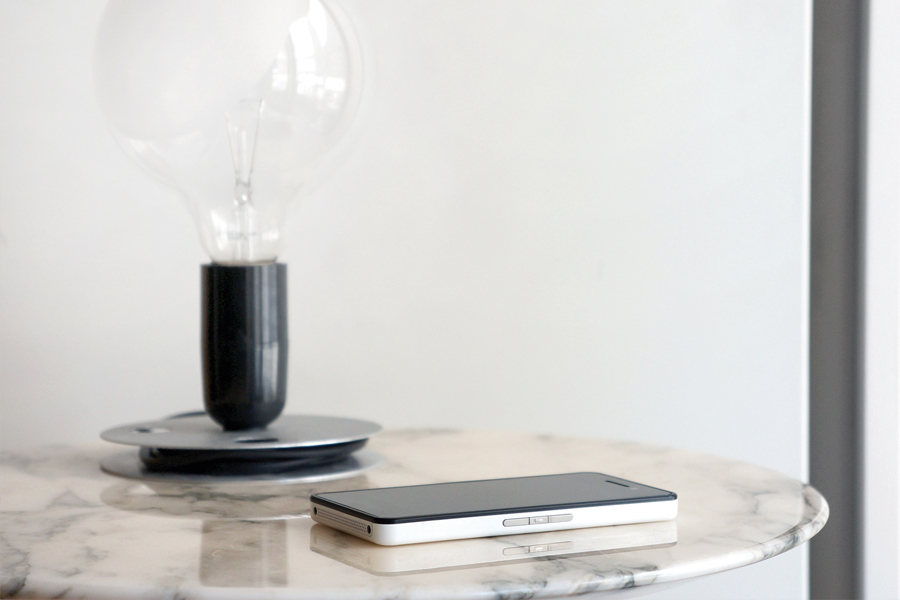
The image size is (900, 600). Identify the location of screen. (508, 483).